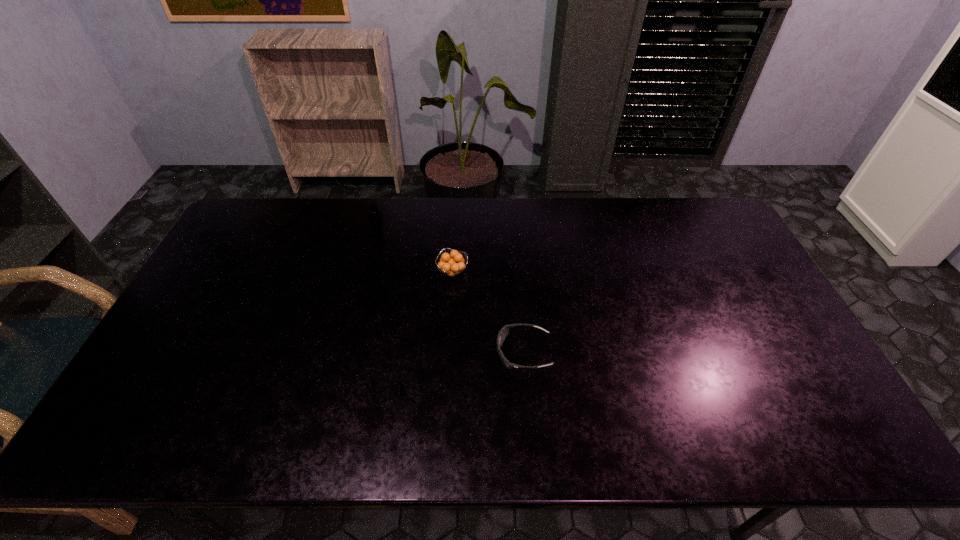
Locate an element on the screen. This screenshot has height=540, width=960. empty space that is in between the second shortest object and the shortest object is located at coordinates (488, 312).

At what (x,y) coordinates should I click in order to perform the action: click on vacant point located between the farthest object and the rightmost object. Please return your answer as a coordinate pair (x, y). The width and height of the screenshot is (960, 540). Looking at the image, I should click on (x=450, y=289).

Locate an element on the screen. This screenshot has height=540, width=960. free spot between the Lego and the shortest object is located at coordinates (450, 289).

You are a GUI agent. You are given a task and a screenshot of the screen. Output one action in this format:
    pyautogui.click(x=<x>, y=<y>)
    Task: Click on the vacant space in between the farthest object and the orange fruit
    The width and height of the screenshot is (960, 540).
    Given the screenshot: What is the action you would take?
    pyautogui.click(x=415, y=249)

The width and height of the screenshot is (960, 540). I want to click on empty space between the farthest object and the second object from left to right, so click(415, 249).

Identify the location of vacant point located between the shortest object and the second farthest object. (488, 312).

The height and width of the screenshot is (540, 960). Find the location of `free space between the leftmost object and the orange fruit`. free space between the leftmost object and the orange fruit is located at coordinates (415, 249).

The height and width of the screenshot is (540, 960). In order to click on object that ranks as the closest to the shortest object in this screenshot , I will do `click(453, 266)`.

Locate an element on the screen. The width and height of the screenshot is (960, 540). the closest object relative to the orange fruit is located at coordinates (504, 332).

The height and width of the screenshot is (540, 960). In order to click on blank area in the image that satisfies the following two spatial constraints: 1. on the front-facing side of the Lego; 2. on the left side of the second object from right to left in this screenshot , I will do `click(365, 272)`.